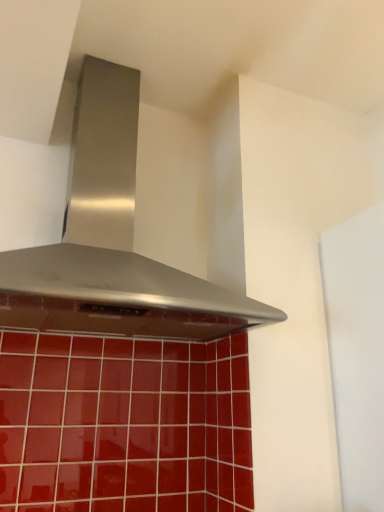
Describe the element at coordinates (112, 241) in the screenshot. I see `stainless steel range hood at center` at that location.

In order to face stainless steel range hood at center, should I rotate leftwards or rightwards?

To align with it, rotate left about 9.501°.

Image resolution: width=384 pixels, height=512 pixels. What are the coordinates of `stainless steel range hood at center` in the screenshot? It's located at (112, 241).

Image resolution: width=384 pixels, height=512 pixels. Identify the location of stainless steel range hood at center. (112, 241).